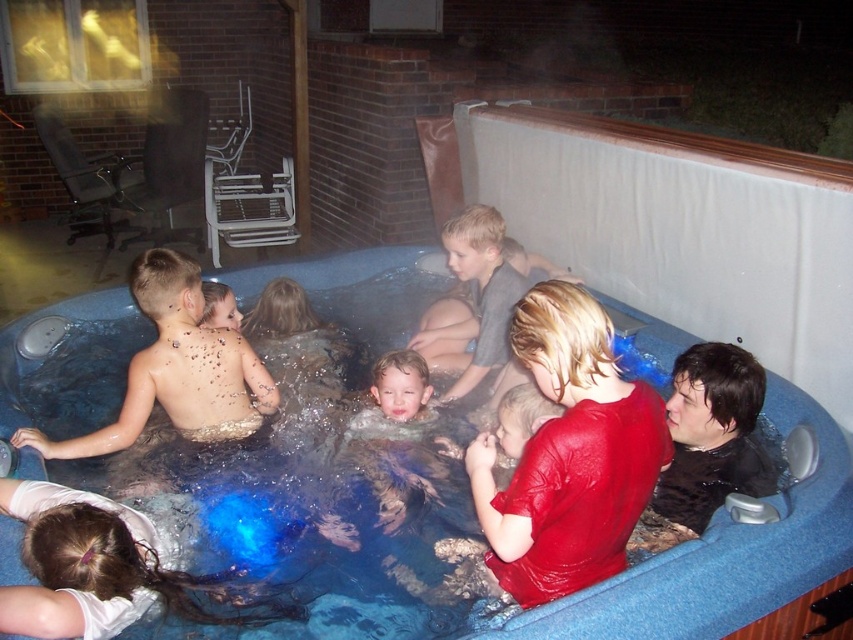
Which is in front, point (654, 468) or point (711, 385)?

Point (654, 468)

Does point (560, 572) come closer to viewer compared to point (665, 486)?

Yes, it is in front of point (665, 486).

Locate an element on the screen. smooth red shirt at center is located at coordinates (569, 454).

Which of these two, smooth red shirt at center or smooth tan skin at left, stands shorter?

Standing shorter between the two is smooth tan skin at left.

Does smooth red shirt at center appear over smooth tan skin at left?

No.

Is point (564, 524) in front of point (270, 388)?

Yes.

I want to click on smooth red shirt at center, so click(569, 454).

Between white matte hair at lower left and black matte shirt at lower right, which one has less height?

With less height is white matte hair at lower left.

Which is more to the left, white matte hair at lower left or black matte shirt at lower right?

From the viewer's perspective, white matte hair at lower left appears more on the left side.

Is point (61, 637) positioned after point (693, 428)?

No, (61, 637) is closer to viewer.

You are a GUI agent. You are given a task and a screenshot of the screen. Output one action in this format:
    pyautogui.click(x=<x>, y=<y>)
    Task: Click on the white matte hair at lower left
    
    Given the screenshot: What is the action you would take?
    pyautogui.click(x=90, y=566)